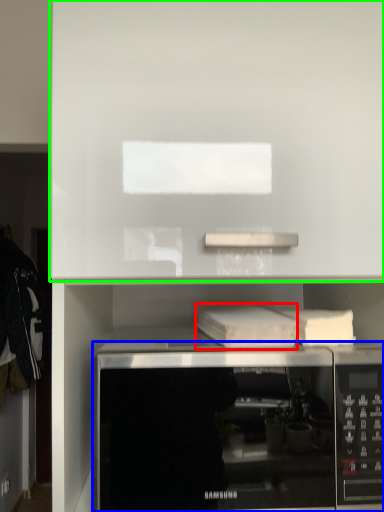
Question: Which is nearer to the book (highlighted by a red box)? microwave oven (highlighted by a blue box) or cabinet (highlighted by a green box).

Choices:
 (A) microwave oven
 (B) cabinet

Answer: (A)